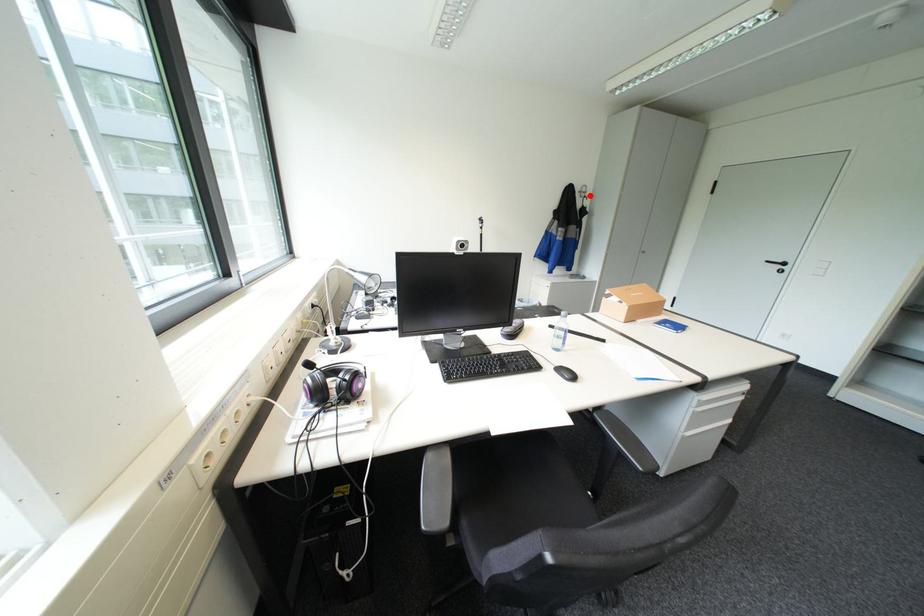
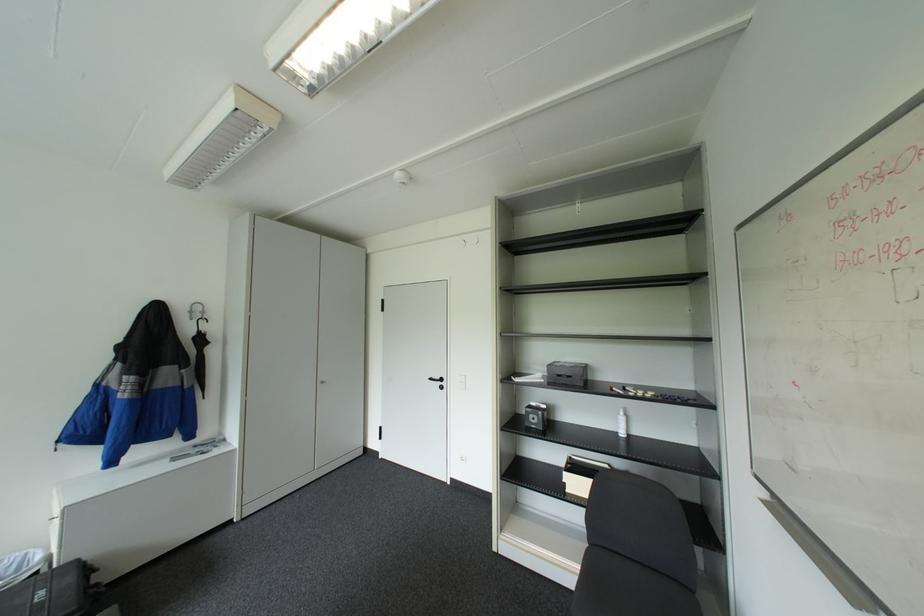
The point at the highlighted location is marked in the first image. Where is the corresponding point in the second image?

(200, 318)